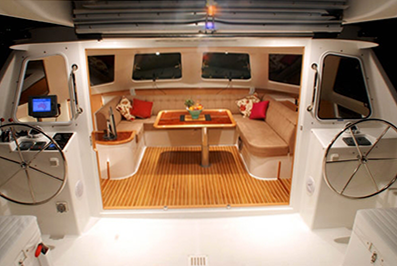
What are the coordinates of `floral throw pillows` in the screenshot? It's located at (247, 104), (125, 107).